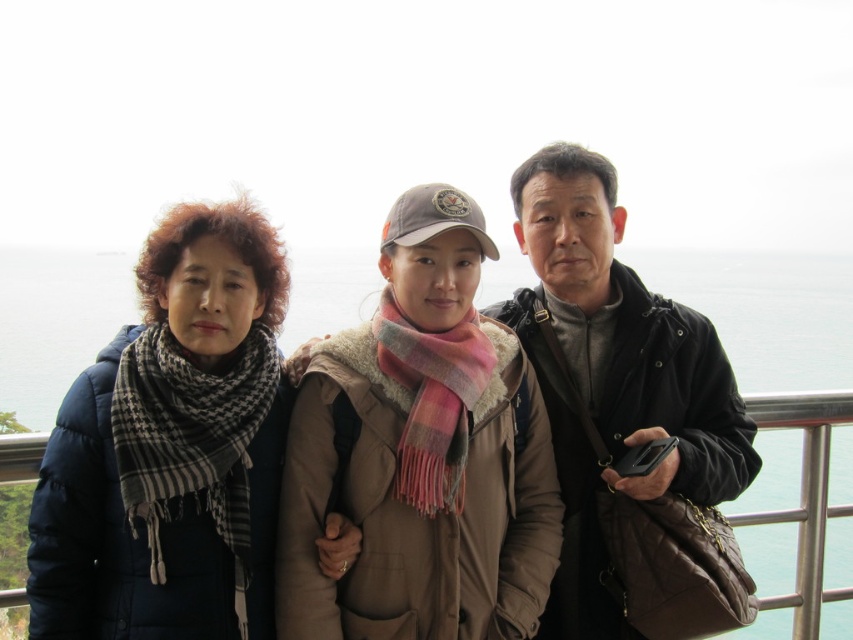
You are a photographer trying to capture a group photo of the plaid scarf at center and the matte black jacket at right. Based on their positions, which object should you focus on first to ensure both are in frame?

The plaid scarf at center is positioned on the left side of matte black jacket at right, so you should focus on the plaid scarf at center first to ensure both are in frame.